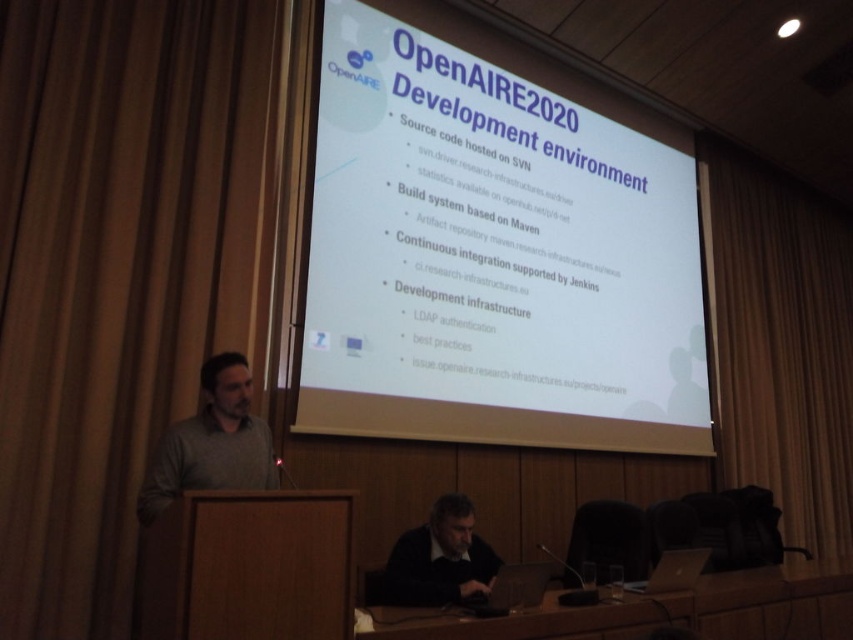
Question: Which point appears closest to the camera in this image?

Choices:
 (A) (482, 262)
 (B) (42, 580)
 (C) (715, 326)

Answer: (B)

Question: Can you confirm if brown fabric curtain at right is bigger than dark gray sweater at lower center?

Choices:
 (A) no
 (B) yes

Answer: (B)

Question: Which of the following is the closest to the observer?

Choices:
 (A) (614, 326)
 (B) (242, 204)

Answer: (B)

Question: Does wooden table at lower center come behind dark gray sweater at lower center?

Choices:
 (A) no
 (B) yes

Answer: (A)

Question: Which object is farther from the camera taking this photo?

Choices:
 (A) brown fabric curtain at left
 (B) gray matte shirt at left
 (C) brown fabric curtain at right

Answer: (C)

Question: Is brown fabric curtain at left thinner than wooden table at lower center?

Choices:
 (A) no
 (B) yes

Answer: (B)